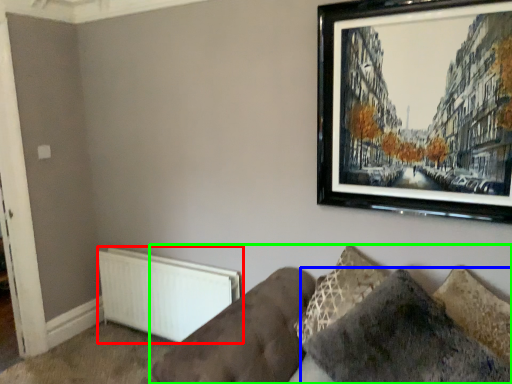
Question: Which is nearer to the radiator (highlighted by a red box)? pillow (highlighted by a blue box) or studio couch (highlighted by a green box).

Choices:
 (A) pillow
 (B) studio couch

Answer: (B)